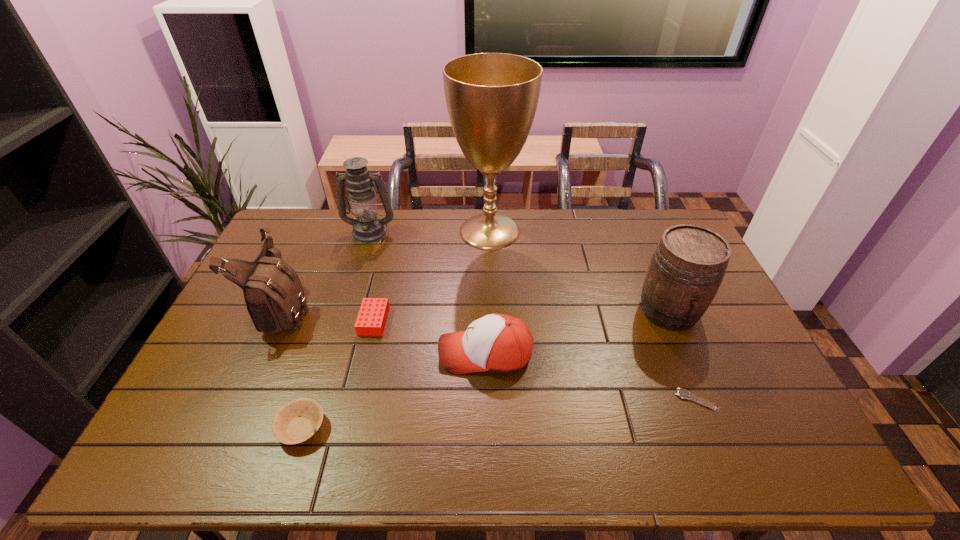
I want to click on the second closest object to the cider, so click(496, 342).

Identify the location of object that is the third nearest to the shoulder bag. The height and width of the screenshot is (540, 960). (295, 422).

What are the coordinates of `vacant region that satisfies the following two spatial constraints: 1. on the back side of the seventh tallest object; 2. on the front-facing side of the shoulder bag` in the screenshot? It's located at (339, 308).

Locate an element on the screen. The image size is (960, 540). free region that satisfies the following two spatial constraints: 1. on the front-facing side of the leftmost object; 2. on the right side of the shortest object is located at coordinates (245, 401).

Locate an element on the screen. This screenshot has width=960, height=540. free region that satisfies the following two spatial constraints: 1. on the front-facing side of the shoulder bag; 2. on the right side of the seventh tallest object is located at coordinates (233, 427).

Find the location of a particular element. Image resolution: width=960 pixels, height=540 pixels. free space in the image that satisfies the following two spatial constraints: 1. on the back side of the oil lamp; 2. on the left side of the bowl is located at coordinates (364, 232).